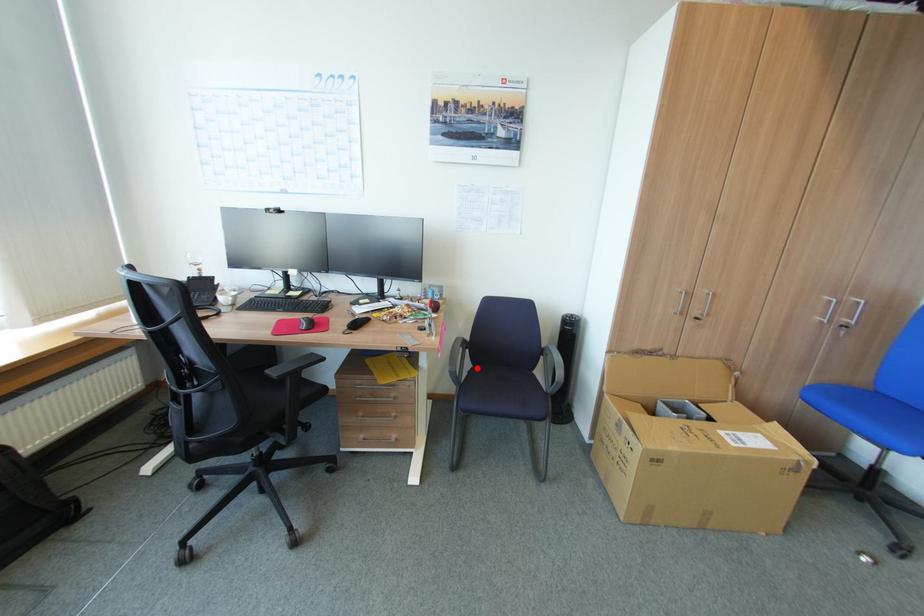
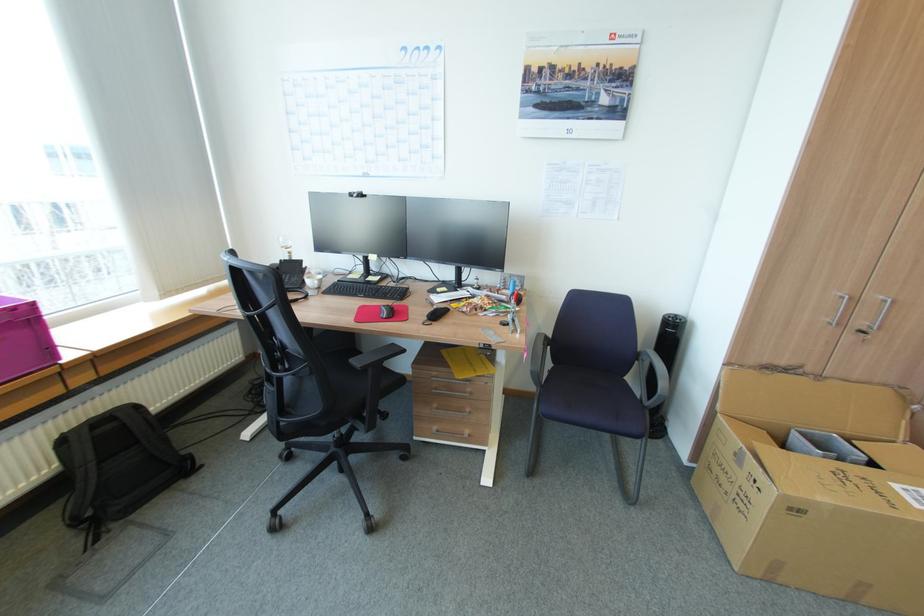
Question: A red point is marked in image1. In image2, is the corresponding 3D point closer to the camera or farther? Reply with the corresponding letter.

Choices:
 (A) The corresponding 3D point is closer.
 (B) The corresponding 3D point is farther.

Answer: (A)